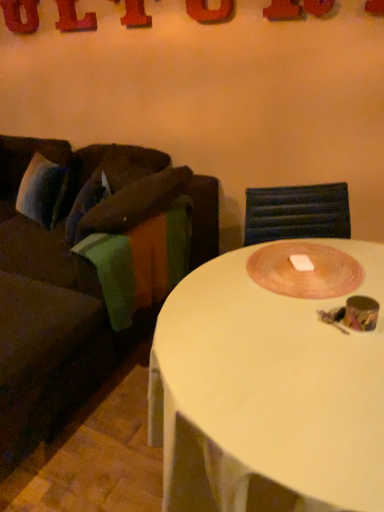
The image size is (384, 512). What do you see at coordinates (270, 379) in the screenshot?
I see `white plastic coffee table at center` at bounding box center [270, 379].

Image resolution: width=384 pixels, height=512 pixels. What do you see at coordinates (304, 270) in the screenshot?
I see `wooden placemat at center` at bounding box center [304, 270].

You are a GUI agent. You are given a task and a screenshot of the screen. Output one action in this format:
    pyautogui.click(x=<x>, y=<y>)
    Task: Click on the wooden placemat at center
    
    Given the screenshot: What is the action you would take?
    pyautogui.click(x=304, y=270)

In order to face metallic red letter at upper center, arranged as the third letter when viewed from the front, should I rotate leftwards or rightwards?

Rotate your view left by about 7.966°.

Describe the element at coordinates (140, 261) in the screenshot. The image size is (384, 512). I see `green fabric blanket at left` at that location.

Identify the location of red plastic letter l at upper left, which is counted as the 4th letter, starting from the right. (74, 18).

Considering the relative sizes of green fabric blanket at left and matte orange letter at upper center, marked as the 2th letter in a right-to-left arrangement, in the image provided, is green fabric blanket at left shorter than matte orange letter at upper center, marked as the 2th letter in a right-to-left arrangement,?

In fact, green fabric blanket at left may be taller than matte orange letter at upper center, marked as the 2th letter in a right-to-left arrangement.

From the picture: Is green fabric blanket at left oriented towards matte orange letter at upper center, which ranks as the 4th letter in back-to-front order?

No, green fabric blanket at left is not oriented towards matte orange letter at upper center, which ranks as the 4th letter in back-to-front order.

Is green fabric blanket at left not within matte orange letter at upper center, which ranks as the 4th letter in back-to-front order?

Yes, green fabric blanket at left is outside of matte orange letter at upper center, which ranks as the 4th letter in back-to-front order.

From the image's perspective, which is below, green fabric blanket at left or matte orange letter at upper center, the 2th letter in the front-to-back sequence?

green fabric blanket at left.

Does point (208, 10) lie behind point (33, 32)?

No, (208, 10) is closer to viewer.

How much distance is there between matte orange letter at upper center, marked as the 2th letter in a right-to-left arrangement, and red plastic letter at upper left, which ranks as the first letter in back-to-front order?

matte orange letter at upper center, marked as the 2th letter in a right-to-left arrangement, and red plastic letter at upper left, which ranks as the first letter in back-to-front order, are 1.30 meters apart.

From the picture: Which is more to the left, matte orange letter at upper center, which is the fourth letter from left to right, or red plastic letter at upper left, which is the 5th letter in front-to-back order?

red plastic letter at upper left, which is the 5th letter in front-to-back order.

Who is taller, matte orange letter at upper center, the 2th letter in the front-to-back sequence, or red plastic letter at upper left, which is the 5th letter in front-to-back order?

matte orange letter at upper center, the 2th letter in the front-to-back sequence, is taller.

Between wooden placemat at center and red plastic letter l at upper left, which is counted as the 4th letter, starting from the right, which one is positioned in front?

wooden placemat at center.

Between wooden placemat at center and red plastic letter l at upper left, which ranks as the fourth letter in front-to-back order, which one has larger width?

Wider between the two is wooden placemat at center.

Considering the relative positions of wooden placemat at center and red plastic letter l at upper left, acting as the 2th letter starting from the left, in the image provided, is wooden placemat at center to the left of red plastic letter l at upper left, acting as the 2th letter starting from the left, from the viewer's perspective?

Incorrect, wooden placemat at center is not on the left side of red plastic letter l at upper left, acting as the 2th letter starting from the left.

Considering the sizes of objects wooden placemat at center and red plastic letter l at upper left, acting as the 2th letter starting from the left, in the image provided, who is bigger, wooden placemat at center or red plastic letter l at upper left, acting as the 2th letter starting from the left,?

wooden placemat at center.

In the scene shown: Is red plastic letter at upper right, which is counted as the 5th letter, starting from the back, in front of or behind red plastic letter l at upper left, which is counted as the 4th letter, starting from the right, in the image?

In the image, red plastic letter at upper right, which is counted as the 5th letter, starting from the back, appears in front of red plastic letter l at upper left, which is counted as the 4th letter, starting from the right.

Is point (374, 9) positioned behind point (67, 18)?

No, (374, 9) is closer to viewer.

Considering the sizes of objects red plastic letter at upper right, which appears as the first letter when viewed from the right, and red plastic letter l at upper left, which is counted as the 4th letter, starting from the right, in the image provided, who is wider, red plastic letter at upper right, which appears as the first letter when viewed from the right, or red plastic letter l at upper left, which is counted as the 4th letter, starting from the right,?

red plastic letter at upper right, which appears as the first letter when viewed from the right, is wider.

Is red plastic letter at upper right, which appears as the first letter when viewed from the front, to the left of red plastic letter l at upper left, acting as the 2th letter starting from the left, from the viewer's perspective?

No, red plastic letter at upper right, which appears as the first letter when viewed from the front, is not to the left of red plastic letter l at upper left, acting as the 2th letter starting from the left.

Is point (200, 20) closer to viewer compared to point (260, 332)?

No, it is behind (260, 332).

How much distance is there between matte orange letter at upper center, the 2th letter in the front-to-back sequence, and white plastic coffee table at center?

matte orange letter at upper center, the 2th letter in the front-to-back sequence, is 1.93 meters from white plastic coffee table at center.

Is matte orange letter at upper center, the 2th letter in the front-to-back sequence, further to the viewer compared to white plastic coffee table at center?

Yes, matte orange letter at upper center, the 2th letter in the front-to-back sequence, is further from the camera.

Considering the sizes of objects matte orange letter at upper center, the 2th letter in the front-to-back sequence, and white plastic coffee table at center in the image provided, who is taller, matte orange letter at upper center, the 2th letter in the front-to-back sequence, or white plastic coffee table at center?

white plastic coffee table at center.

Could white plastic coffee table at center be considered to be inside green fabric blanket at left?

No, white plastic coffee table at center is not a part of green fabric blanket at left.

From the picture: Does green fabric blanket at left turn towards white plastic coffee table at center?

No, green fabric blanket at left is not oriented towards white plastic coffee table at center.

From a real-world perspective, which object stands above the other?

green fabric blanket at left, from a real-world perspective.

Is green fabric blanket at left placed right next to white plastic coffee table at center?

They are not placed beside each other.

From a real-world perspective, is brown fabric couch at left on metallic red letter at upper center, positioned as the 3th letter in back-to-front order?

No, from a real-world perspective, brown fabric couch at left is not above metallic red letter at upper center, positioned as the 3th letter in back-to-front order.

From the image's perspective, is brown fabric couch at left positioned above or below metallic red letter at upper center, arranged as the third letter when viewed from the front?

brown fabric couch at left is below metallic red letter at upper center, arranged as the third letter when viewed from the front.

Between brown fabric couch at left and metallic red letter at upper center, which is counted as the third letter, starting from the left, which one has smaller size?

Smaller between the two is metallic red letter at upper center, which is counted as the third letter, starting from the left.

How different are the orientations of brown fabric couch at left and metallic red letter at upper center, the 3th letter when ordered from right to left, in degrees?

0.572 degrees separate the facing orientations of brown fabric couch at left and metallic red letter at upper center, the 3th letter when ordered from right to left.

Where is `the 2nd letter behind the green fabric blanket at left`? The image size is (384, 512). the 2nd letter behind the green fabric blanket at left is located at coordinates (210, 11).

Where is `letter that is the 3rd object located below the red plastic letter at upper left, which ranks as the first letter in left-to-right order (from the image's perspective)`? Image resolution: width=384 pixels, height=512 pixels. letter that is the 3rd object located below the red plastic letter at upper left, which ranks as the first letter in left-to-right order (from the image's perspective) is located at coordinates (210, 11).

Which object lies further to the anchor point green fabric blanket at left, white plastic coffee table at center or red plastic letter l at upper left, the second letter from the back?

Among the two, red plastic letter l at upper left, the second letter from the back, is located further to green fabric blanket at left.

Looking at the image, which one is located closer to metallic red letter at upper center, arranged as the third letter when viewed from the front, red plastic letter l at upper left, which is counted as the 4th letter, starting from the right, or wooden placemat at center?

red plastic letter l at upper left, which is counted as the 4th letter, starting from the right, lies closer to metallic red letter at upper center, arranged as the third letter when viewed from the front, than the other object.

Based on the photo, which object lies nearer to the anchor point red plastic letter l at upper left, which ranks as the fourth letter in front-to-back order, matte orange letter at upper center, which is the fourth letter from left to right, or green fabric blanket at left?

Among the two, matte orange letter at upper center, which is the fourth letter from left to right, is located nearer to red plastic letter l at upper left, which ranks as the fourth letter in front-to-back order.

From the picture: Looking at the image, which one is located closer to brown fabric couch at left, matte orange letter at upper center, the 2th letter in the front-to-back sequence, or white plastic coffee table at center?

white plastic coffee table at center is closer to brown fabric couch at left.

Based on the photo, estimate the real-world distances between objects in this image. Which object is closer to matte orange letter at upper center, which is the fourth letter from left to right, red plastic letter l at upper left, which is counted as the 4th letter, starting from the right, or metallic red letter at upper center, which is counted as the third letter, starting from the left?

metallic red letter at upper center, which is counted as the third letter, starting from the left, is closer to matte orange letter at upper center, which is the fourth letter from left to right.

Which object lies further to the anchor point matte orange letter at upper center, marked as the 2th letter in a right-to-left arrangement, metallic red letter at upper center, arranged as the third letter when viewed from the front, or brown fabric couch at left?

brown fabric couch at left lies further to matte orange letter at upper center, marked as the 2th letter in a right-to-left arrangement, than the other object.

Considering their positions, is red plastic letter l at upper left, which is counted as the 4th letter, starting from the right, positioned further to green fabric blanket at left than brown fabric couch at left?

red plastic letter l at upper left, which is counted as the 4th letter, starting from the right, is positioned further to the anchor green fabric blanket at left.

Considering their positions, is metallic red letter at upper center, arranged as the third letter when viewed from the front, positioned closer to brown fabric couch at left than wooden placemat at center?

wooden placemat at center is positioned closer to the anchor brown fabric couch at left.

This screenshot has height=512, width=384. I want to click on oval between white plastic coffee table at center and green fabric blanket at left from front to back, so click(304, 270).

What are the coordinates of `letter between metallic red letter at upper center, which is counted as the third letter, starting from the left, and red plastic letter at upper right, which appears as the first letter when viewed from the right, in the horizontal direction` in the screenshot? It's located at (210, 11).

At what (x,y) coordinates should I click in order to perform the action: click on blanket that lies between metallic red letter at upper center, which is counted as the third letter, starting from the left, and white plastic coffee table at center from top to bottom. Please return your answer as a coordinate pair (x, y). Looking at the image, I should click on (140, 261).

At what (x,y) coordinates should I click in order to perform the action: click on blanket between red plastic letter at upper right, which is counted as the 5th letter, starting from the back, and white plastic coffee table at center vertically. Please return your answer as a coordinate pair (x, y). Looking at the image, I should click on (140, 261).